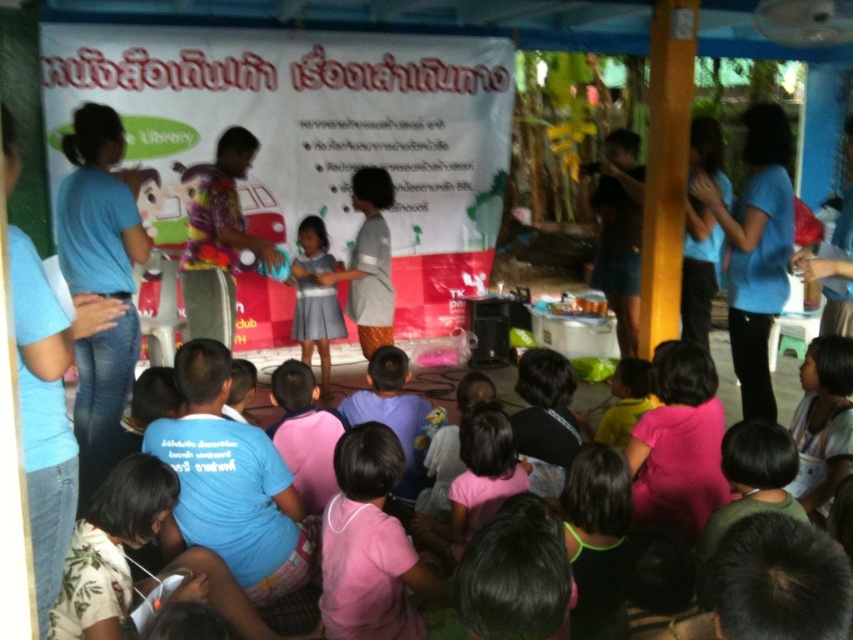
Question: Considering the real-world distances, which object is closest to the floral fabric shirt at center?

Choices:
 (A) pink matte shirt at lower center
 (B) matte gray dress at center

Answer: (B)

Question: Which is nearer to the pink matte shirt at lower center?

Choices:
 (A) floral fabric shirt at center
 (B) matte gray dress at center

Answer: (A)

Question: Is pink matte shirt at lower center behind matte gray dress at center?

Choices:
 (A) no
 (B) yes

Answer: (A)

Question: Does floral fabric shirt at center have a larger size compared to matte gray dress at center?

Choices:
 (A) yes
 (B) no

Answer: (A)

Question: Based on their relative distances, which object is farther from the matte gray dress at center?

Choices:
 (A) floral fabric shirt at center
 (B) pink matte shirt at lower center

Answer: (B)

Question: Is floral fabric shirt at center to the right of matte gray dress at center from the viewer's perspective?

Choices:
 (A) no
 (B) yes

Answer: (A)